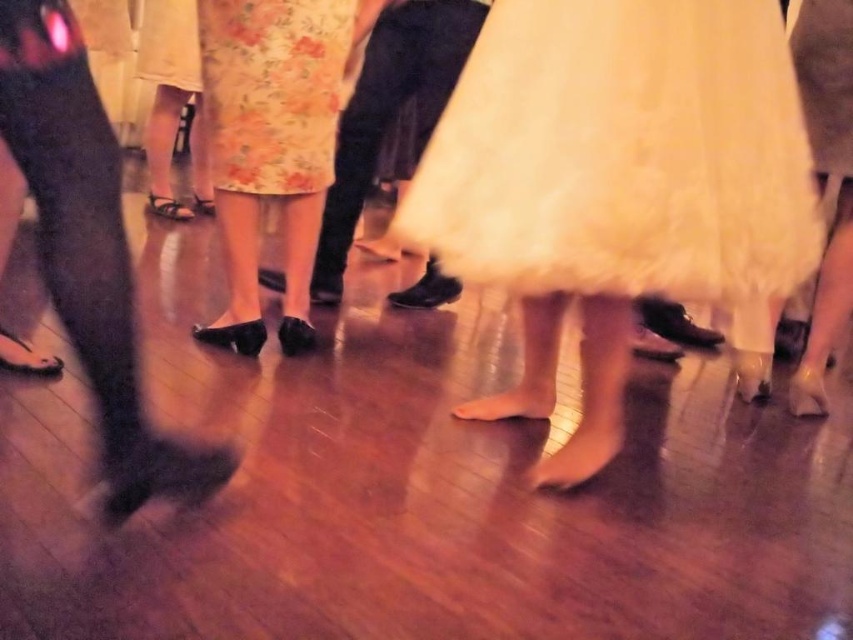
Question: Does white satin dress at center come behind floral fabric skirt at center?

Choices:
 (A) no
 (B) yes

Answer: (A)

Question: Is white satin dress at center to the right of floral fabric dress at center from the viewer's perspective?

Choices:
 (A) yes
 (B) no

Answer: (A)

Question: Which of the following is the farthest from the observer?

Choices:
 (A) (283, 145)
 (B) (177, 13)
 (C) (231, 264)
 (D) (762, 3)

Answer: (B)

Question: Which point is closer to the camera taking this photo?

Choices:
 (A) (142, 17)
 (B) (436, 180)
 (C) (303, 147)

Answer: (B)

Question: Among these objects, which one is farthest from the camera?

Choices:
 (A) floral fabric skirt at center
 (B) floral fabric skirt at upper left

Answer: (B)

Question: Can you confirm if white satin dress at center is positioned above floral fabric skirt at center?

Choices:
 (A) yes
 (B) no

Answer: (B)